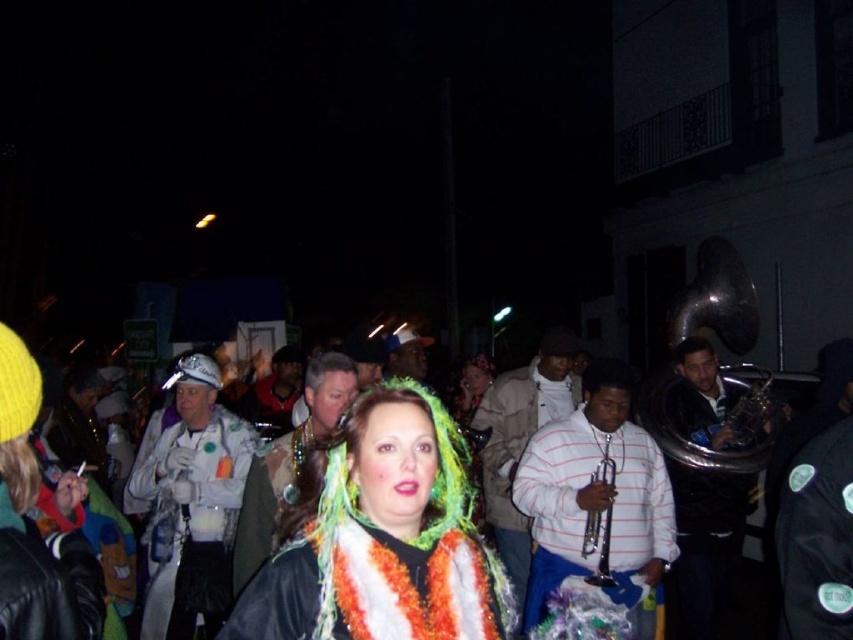
Question: Which of the following is the closest to the observer?

Choices:
 (A) (349, 516)
 (B) (646, 545)
 (C) (346, 624)

Answer: (C)

Question: Which of these objects is positioned closest to the white striped shirt at center?

Choices:
 (A) fluffy multicolored scarf at center
 (B) knitted wool scarf at center

Answer: (A)

Question: Estimate the real-world distances between objects in this image. Which object is farther from the fluffy multicolored scarf at center?

Choices:
 (A) white fabric mask at center
 (B) knitted wool scarf at center

Answer: (A)

Question: Is knitted wool scarf at center bigger than white striped shirt at center?

Choices:
 (A) yes
 (B) no

Answer: (B)

Question: Considering the relative positions of knitted wool scarf at center and white fabric mask at center in the image provided, where is knitted wool scarf at center located with respect to white fabric mask at center?

Choices:
 (A) below
 (B) above

Answer: (B)

Question: Does fluffy multicolored scarf at center have a lesser width compared to knitted wool scarf at center?

Choices:
 (A) no
 (B) yes

Answer: (A)